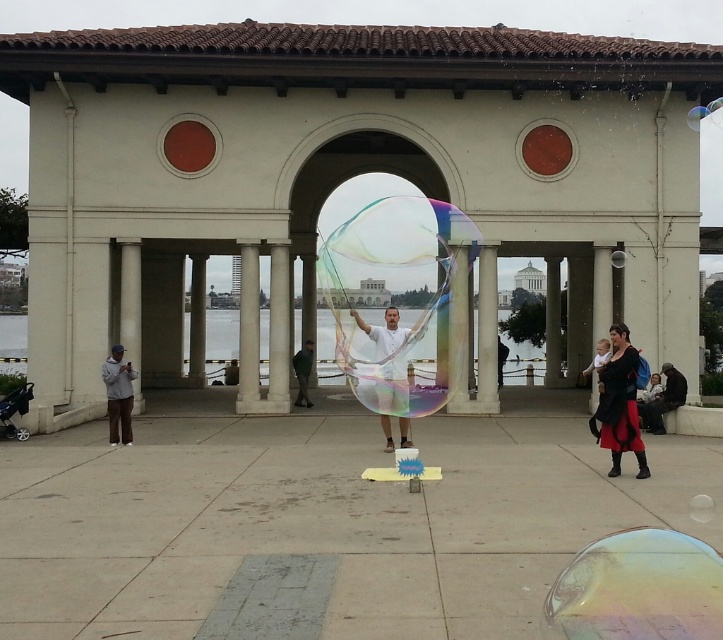
Is white marble pillar at center above dark gray fabric at center?

Correct, white marble pillar at center is located above dark gray fabric at center.

Measure the distance between white marble pillar at center and camera.

They are 20.95 meters apart.

This screenshot has width=723, height=640. I want to click on white marble pillar at center, so click(248, 330).

Does gray hoodie at left have a larger size compared to translucent plastic bubble at center?

No, gray hoodie at left is not bigger than translucent plastic bubble at center.

Is gray hoodie at left to the right of translucent plastic bubble at center from the viewer's perspective?

Incorrect, gray hoodie at left is not on the right side of translucent plastic bubble at center.

Measure the distance between point (100, 376) and camera.

Point (100, 376) and camera are 18.10 meters apart.

The image size is (723, 640). I want to click on gray hoodie at left, so 119,394.

Can you confirm if white marble pillar at center is wider than green fabric pants at center?

Yes.

Between point (241, 301) and point (299, 369), which one is positioned in front?

Positioned in front is point (241, 301).

Is point (241, 326) positioned behind point (296, 376)?

That is False.

You are a GUI agent. You are given a task and a screenshot of the screen. Output one action in this format:
    pyautogui.click(x=<x>, y=<y>)
    Task: Click on the white marble pillar at center
    Image resolution: width=723 pixels, height=640 pixels.
    Given the screenshot: What is the action you would take?
    pyautogui.click(x=248, y=330)